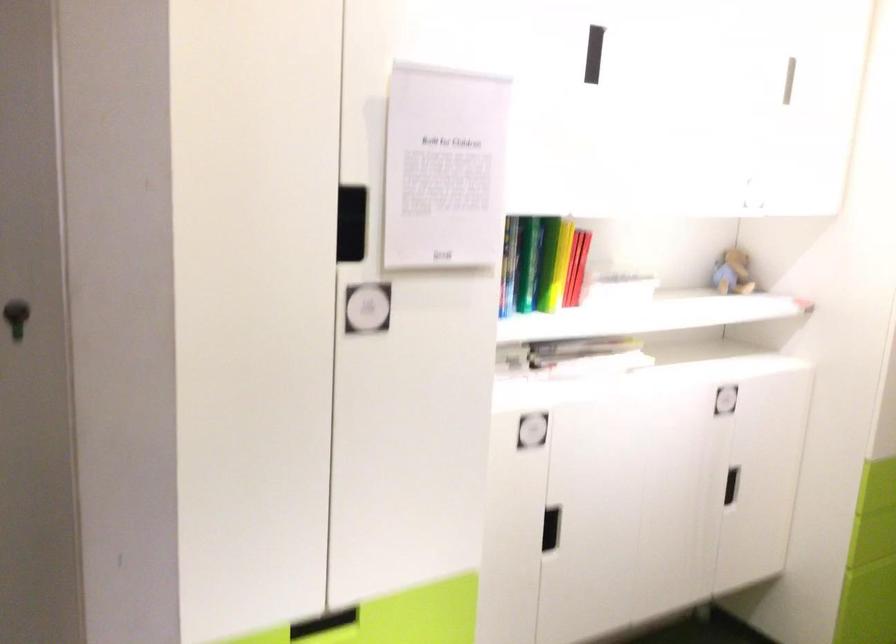
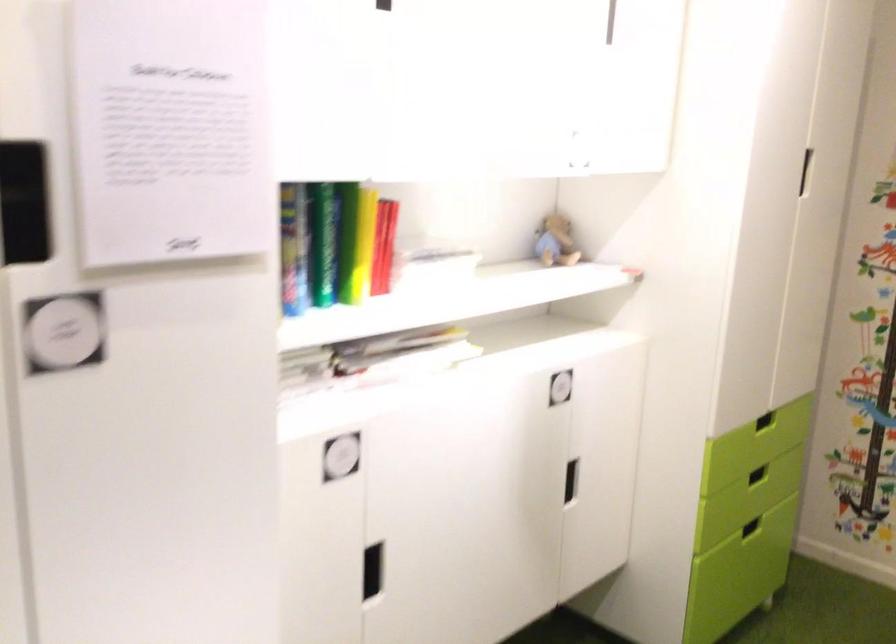
Question: In a continuous first-person perspective shot, in which direction is the camera moving?

Choices:
 (A) Left
 (B) Right
 (C) Forward
 (D) Backward

Answer: (C)